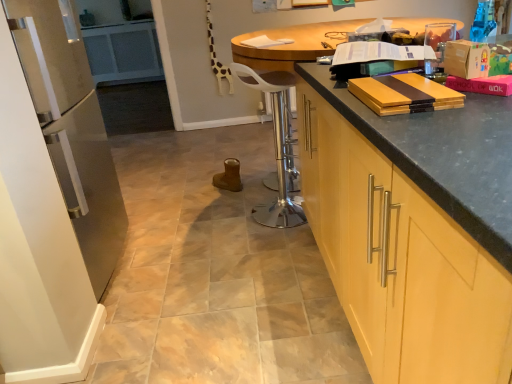
Locate an element on the screen. vacant space to the right of white glossy refrigerator at left is located at coordinates (185, 261).